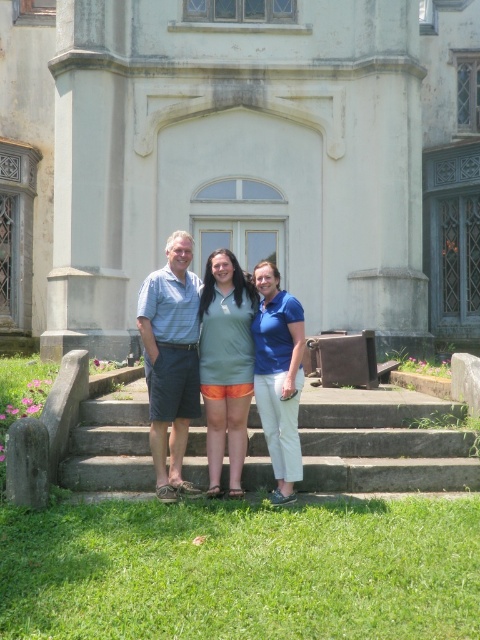
Question: Which point is closer to the camera?

Choices:
 (A) green matte dress at center
 (B) gray concrete stairs at center
 (C) light blue striped shirt at center
 (D) matte blue shirt at center

Answer: (D)

Question: Can you confirm if matte blue shirt at center is smaller than light blue striped shirt at center?

Choices:
 (A) yes
 (B) no

Answer: (B)

Question: From the image, what is the correct spatial relationship of light blue striped shirt at center in relation to green matte dress at center?

Choices:
 (A) right
 (B) left

Answer: (B)

Question: Is gray concrete stairs at center smaller than blue cotton polo shirt at center?

Choices:
 (A) no
 (B) yes

Answer: (A)

Question: Which object appears farthest from the camera in this image?

Choices:
 (A) light blue striped shirt at center
 (B) blue cotton polo shirt at center

Answer: (A)

Question: Which point is farther from the camera taking this photo?

Choices:
 (A) pyautogui.click(x=232, y=376)
 (B) pyautogui.click(x=346, y=484)

Answer: (B)